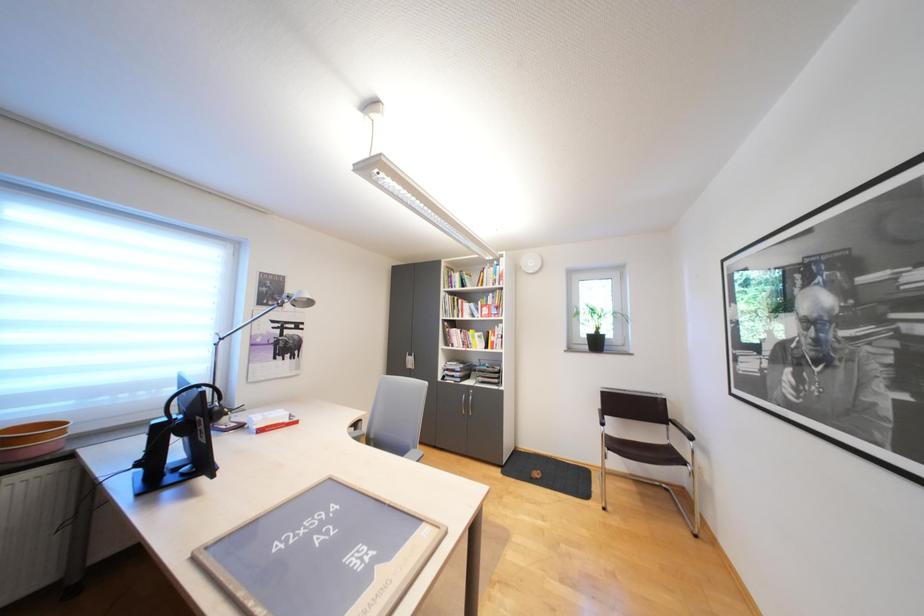
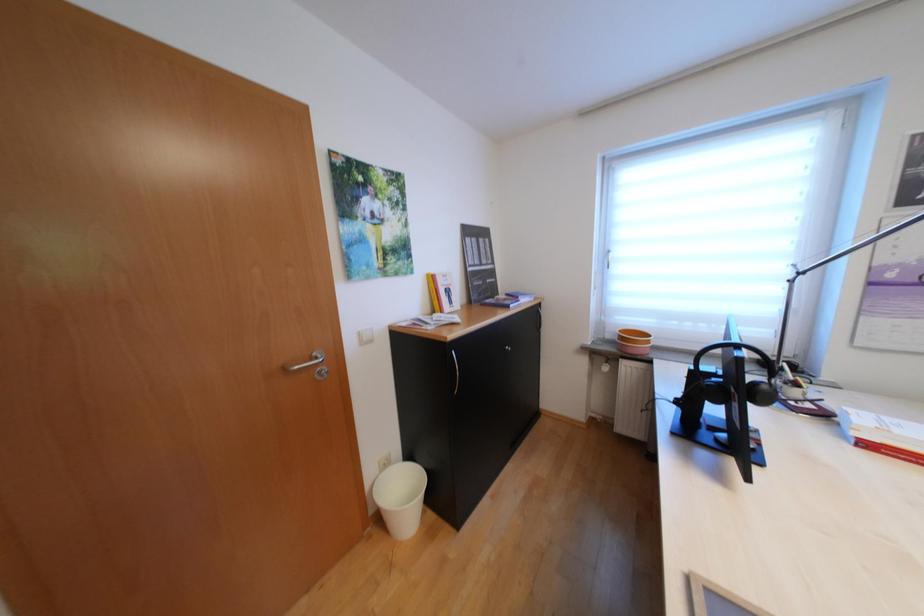
Question: Based on the continuous images, in which direction is the camera rotating? Reply with the corresponding letter.

Choices:
 (A) Left
 (B) Right
 (C) Up
 (D) Down

Answer: (A)